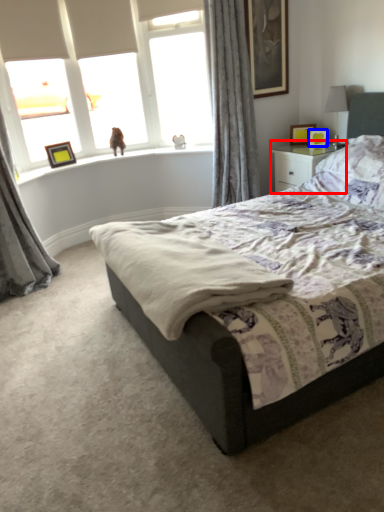
Question: Which of the following is the closest to the observer, nightstand (highlighted by a red box) or picture frame (highlighted by a blue box)?

Choices:
 (A) nightstand
 (B) picture frame

Answer: (A)